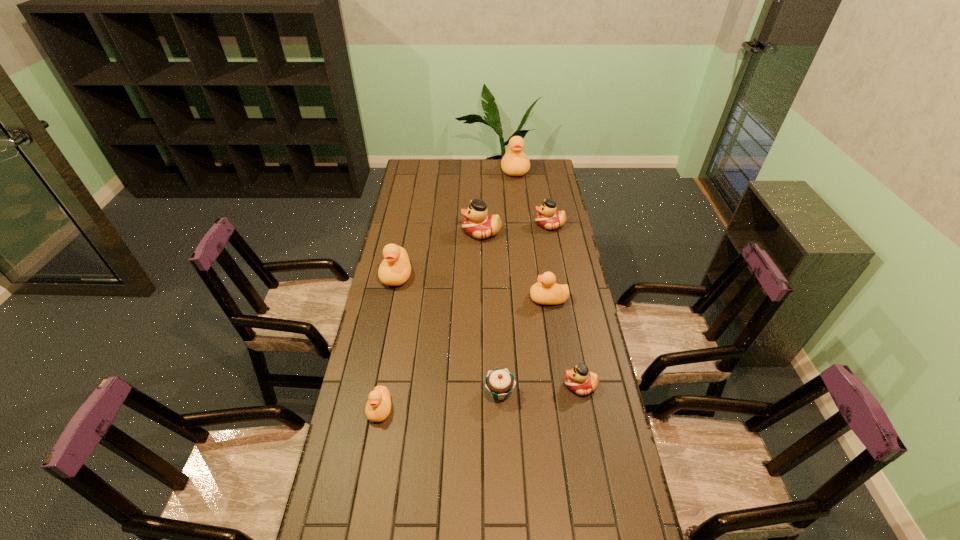
The height and width of the screenshot is (540, 960). Identify the location of vacant space located on the face of the biggest yellow duck. (517, 192).

This screenshot has height=540, width=960. I want to click on vacant space situated on the face of the leftmost red duck, so click(x=448, y=232).

Where is `vacant region located 0.300m on the face of the leftmost red duck`? vacant region located 0.300m on the face of the leftmost red duck is located at coordinates (396, 232).

You are a GUI agent. You are given a task and a screenshot of the screen. Output one action in this format:
    pyautogui.click(x=<x>, y=<y>)
    Task: Click on the free space located on the face of the leftmost red duck
    
    Given the screenshot: What is the action you would take?
    pyautogui.click(x=418, y=232)

You are a GUI agent. You are given a task and a screenshot of the screen. Output one action in this format:
    pyautogui.click(x=<x>, y=<y>)
    Task: Click on the vacant space located 0.310m on the face of the second biggest yellow duck
    
    Given the screenshot: What is the action you would take?
    pyautogui.click(x=380, y=355)

The image size is (960, 540). I want to click on blank space located 0.220m on the face of the second biggest red duck, so click(x=487, y=225).

Identify the location of vacant point located 0.360m on the face of the second biggest red duck. tap(456, 225).

Where is `vacant space located on the face of the second biggest red duck`? The image size is (960, 540). vacant space located on the face of the second biggest red duck is located at coordinates (458, 225).

This screenshot has height=540, width=960. I want to click on vacant area located on the face of the third biggest yellow duck, so (436, 299).

In order to click on free spot located on the face of the third biggest yellow duck in this screenshot , I will do `click(439, 299)`.